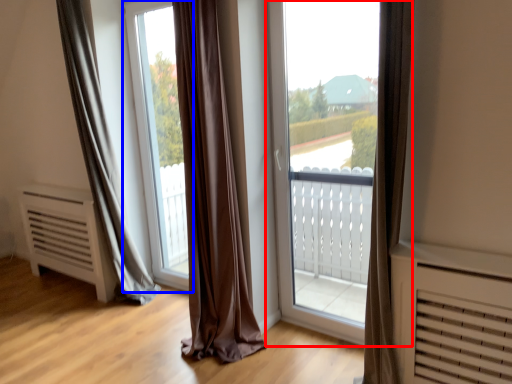
Question: Among these objects, which one is nearest to the camera, window (highlighted by a red box) or window screen (highlighted by a blue box)?

Choices:
 (A) window
 (B) window screen

Answer: (A)